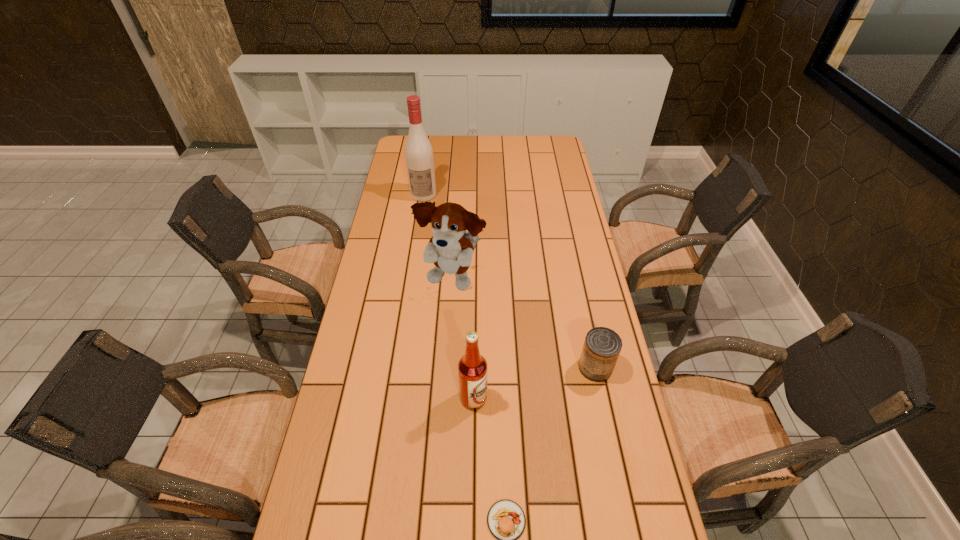
Select which object appears as the closest to the third tallest object. Please provide its 2D coordinates. Your answer should be formatted as a tuple, i.e. [(x, y)], where the tuple contains the x and y coordinates of a point satisfying the conditions above.

[(506, 520)]

Select which object is the fourth closest to the taller alcohol. Please provide its 2D coordinates. Your answer should be formatted as a tuple, i.e. [(x, y)], where the tuple contains the x and y coordinates of a point satisfying the conditions above.

[(506, 520)]

Where is `free space that satisfies the following two spatial constraints: 1. on the face of the rightmost object; 2. on the left side of the puppy`? Image resolution: width=960 pixels, height=540 pixels. free space that satisfies the following two spatial constraints: 1. on the face of the rightmost object; 2. on the left side of the puppy is located at coordinates (447, 368).